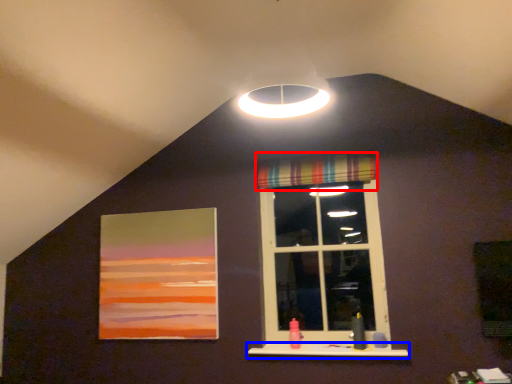
Question: Which point is closer to the camera, curtain (highlighted by a red box) or window sill (highlighted by a blue box)?

Choices:
 (A) curtain
 (B) window sill

Answer: (B)